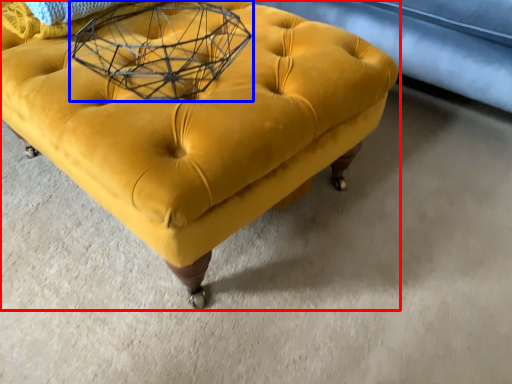
Question: Which point is further to the camera, furniture (highlighted by a red box) or round table (highlighted by a blue box)?

Choices:
 (A) furniture
 (B) round table

Answer: (B)